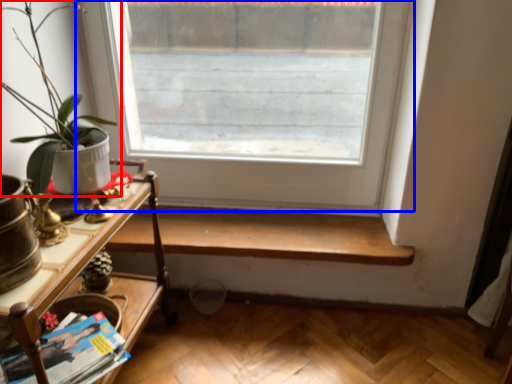
Question: Which of the following is the closest to the observer, houseplant (highlighted by a red box) or window (highlighted by a blue box)?

Choices:
 (A) houseplant
 (B) window

Answer: (A)